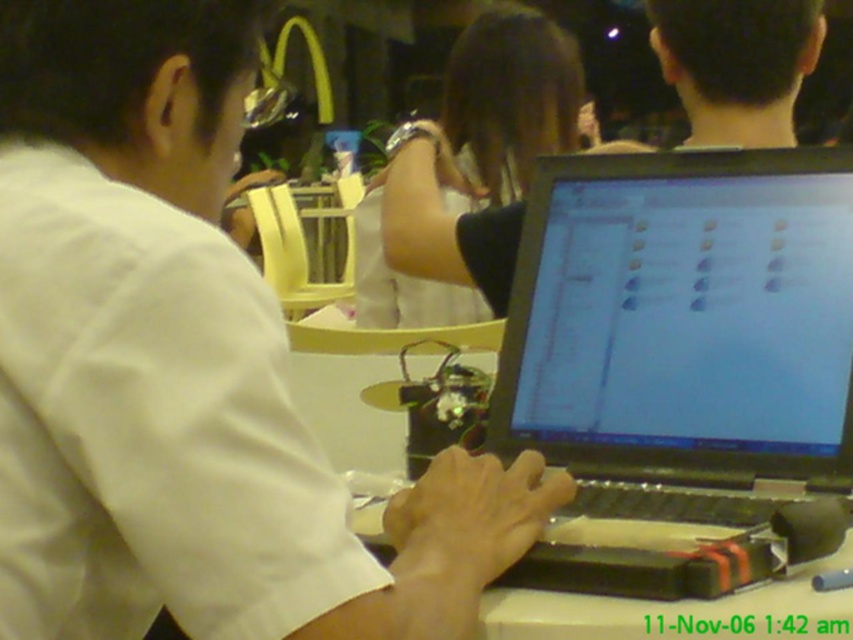
Which of these two, white matte laptop at center or black matte laptop at center, stands taller?

black matte laptop at center is taller.

Which is below, white matte laptop at center or black matte laptop at center?

Positioned lower is white matte laptop at center.

Between point (32, 333) and point (473, 40), which one is positioned in front?

Positioned in front is point (32, 333).

The image size is (853, 640). Identify the location of white matte laptop at center. (183, 368).

Who is higher up, white matte laptop at center or dark hair at upper right?

dark hair at upper right is higher up.

Can you confirm if white matte laptop at center is thinner than dark hair at upper right?

No.

Is point (352, 563) positioned before point (683, 12)?

That is True.

At what (x,y) coordinates should I click in order to perform the action: click on white matte laptop at center. Please return your answer as a coordinate pair (x, y). The width and height of the screenshot is (853, 640). Looking at the image, I should click on (183, 368).

Is matte black laptop at center positioned behind dark hair at upper right?

No, matte black laptop at center is in front of dark hair at upper right.

How far apart are matte black laptop at center and dark hair at upper right?

A distance of 15.79 inches exists between matte black laptop at center and dark hair at upper right.

Describe the element at coordinates (683, 312) in the screenshot. I see `matte black laptop at center` at that location.

At what (x,y) coordinates should I click in order to perform the action: click on matte black laptop at center. Please return your answer as a coordinate pair (x, y). Looking at the image, I should click on (683, 312).